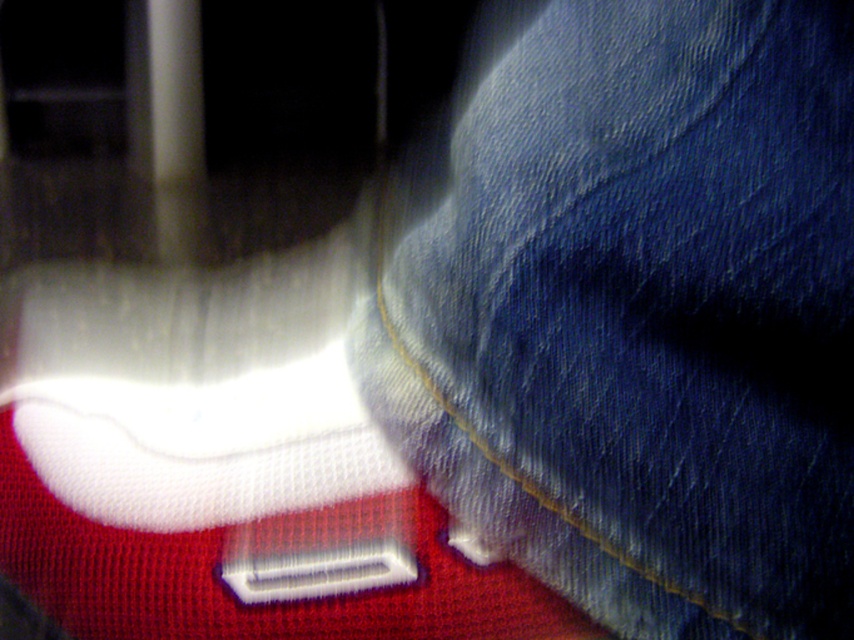
Based on the coordinates provided, which object is located at the point (636, 310) in the image?

The point (636, 310) indicates denim at center.

You are examining the image of a leg and foot. There are two points marked in the image. The first point is at coordinate point (832, 209) and the second point is at coordinate point (541, 588). Which of these two points is closer to you?

Point (832, 209) is closer to the viewer than point (541, 588).